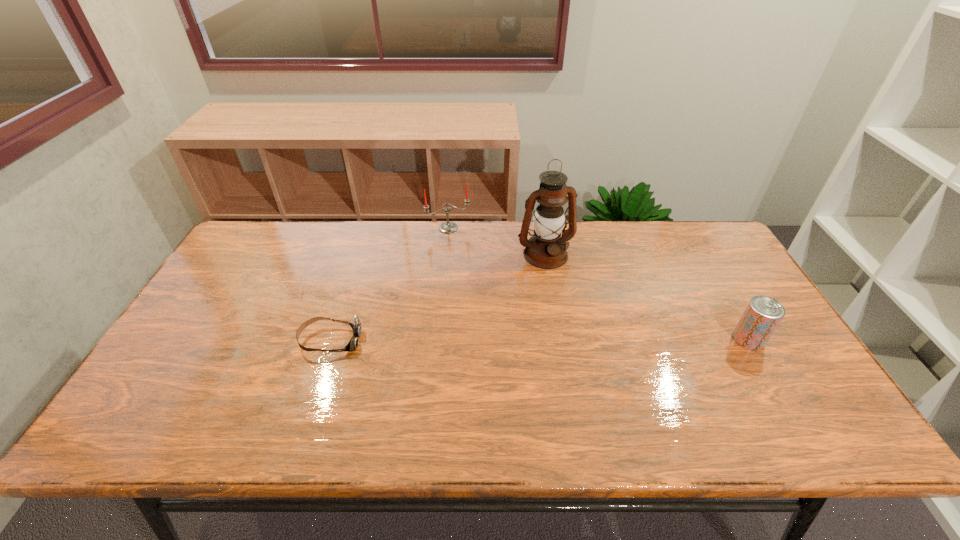
The width and height of the screenshot is (960, 540). What are the coordinates of `vacant space at the near edge` in the screenshot? It's located at (715, 387).

Locate an element on the screen. Image resolution: width=960 pixels, height=540 pixels. free location at the left edge is located at coordinates (193, 335).

This screenshot has height=540, width=960. In the image, there is a desktop. In order to click on vacant area at the right edge in this screenshot , I will do `click(690, 275)`.

The width and height of the screenshot is (960, 540). What are the coordinates of `free space between the candle and the beer can` in the screenshot? It's located at (598, 284).

Image resolution: width=960 pixels, height=540 pixels. Identify the location of free space between the goggles and the tallest object. (438, 298).

Where is `unoccupied position between the beer can and the goggles`? This screenshot has height=540, width=960. unoccupied position between the beer can and the goggles is located at coordinates (540, 340).

Find the location of a particular element. The width and height of the screenshot is (960, 540). vacant area that lies between the shortest object and the rightmost object is located at coordinates (540, 340).

Locate an element on the screen. The image size is (960, 540). free point between the third shortest object and the beer can is located at coordinates (598, 284).

Identify the location of free space between the tallest object and the beer can. Image resolution: width=960 pixels, height=540 pixels. (647, 297).

At what (x,y) coordinates should I click in order to perform the action: click on free space between the second tallest object and the rightmost object. Please return your answer as a coordinate pair (x, y). This screenshot has height=540, width=960. Looking at the image, I should click on (598, 284).